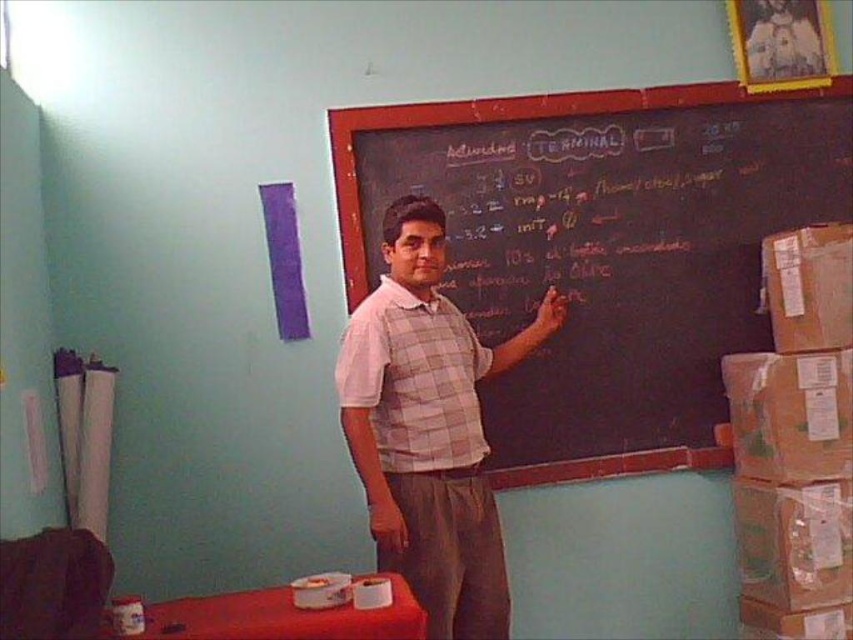
You are a student sitting in the classroom and notice the black chalkboard at upper center and the plaid fabric vest at center. Which object is bigger in size?

The black chalkboard at upper center is larger in size than the plaid fabric vest at center.

You are standing in the classroom and want to reach the point at coordinates point (546, 257) on the chalkboard. If you can reach up to 9 feet, will you be able to reach it?

The distance of point (546, 257) from viewer is 9.55 feet, so you cannot reach it since your maximum reach is 9 feet.

You are a student sitting at the back of the classroom. You need to compare the width of the black chalkboard at upper center and the plaid fabric vest at center. Which one is wider?

The black chalkboard at upper center is wider than the plaid fabric vest at center.